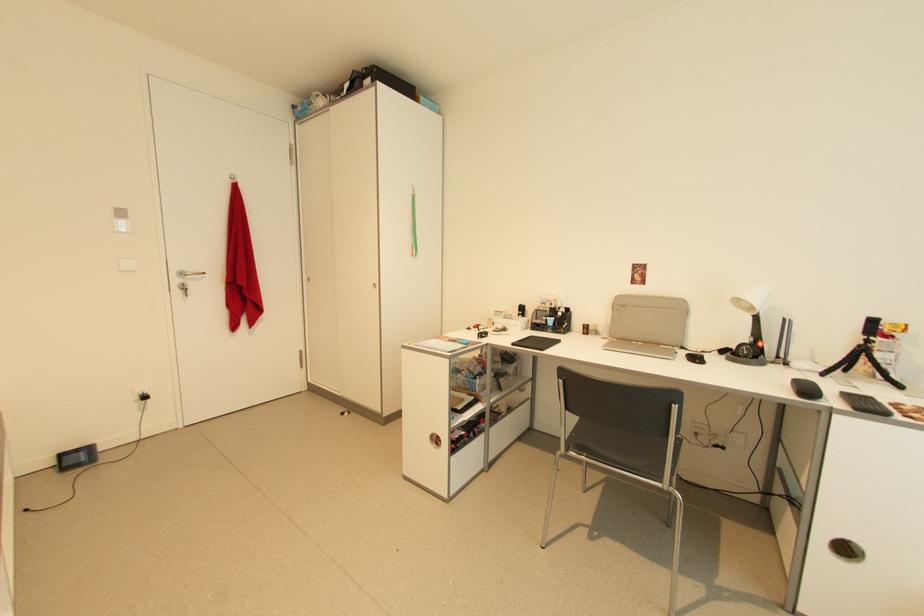
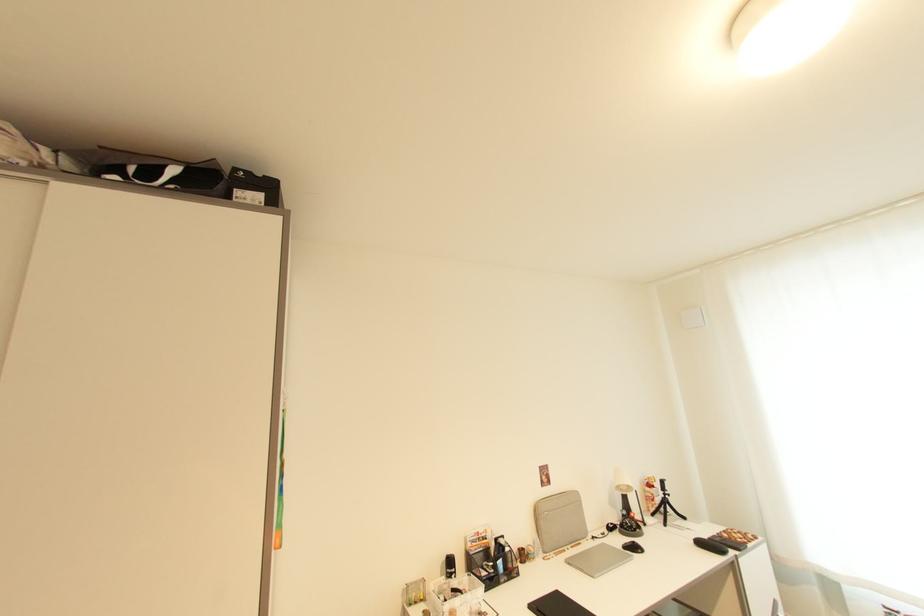
Find the pixel in the second image that matches [336,98] in the first image.

(66, 156)